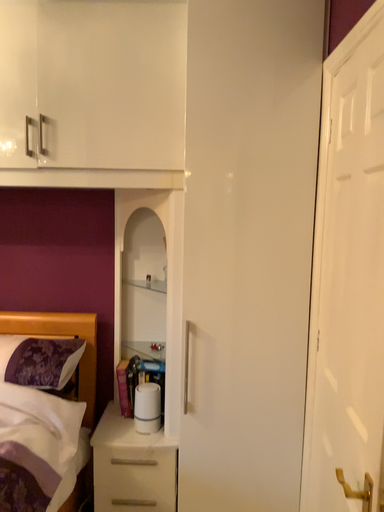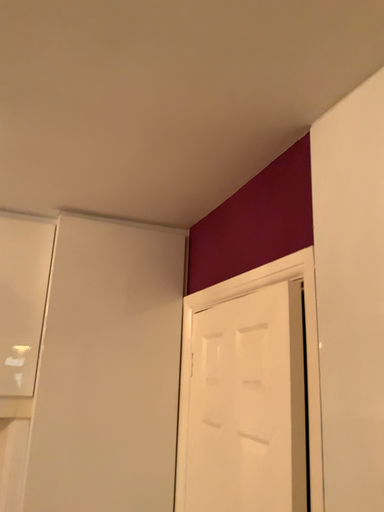
Question: How did the camera likely rotate when shooting the video?

Choices:
 (A) rotated upward
 (B) rotated downward

Answer: (A)